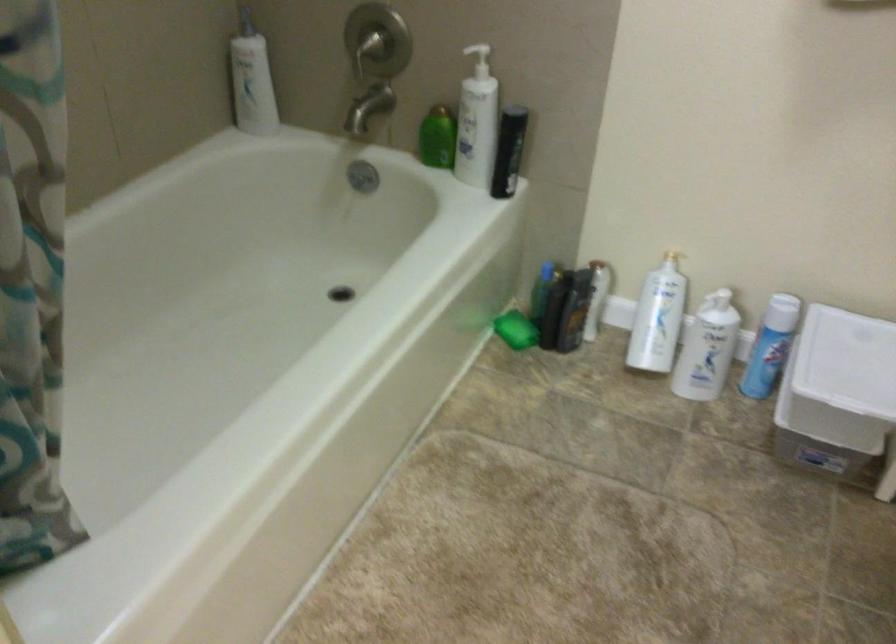
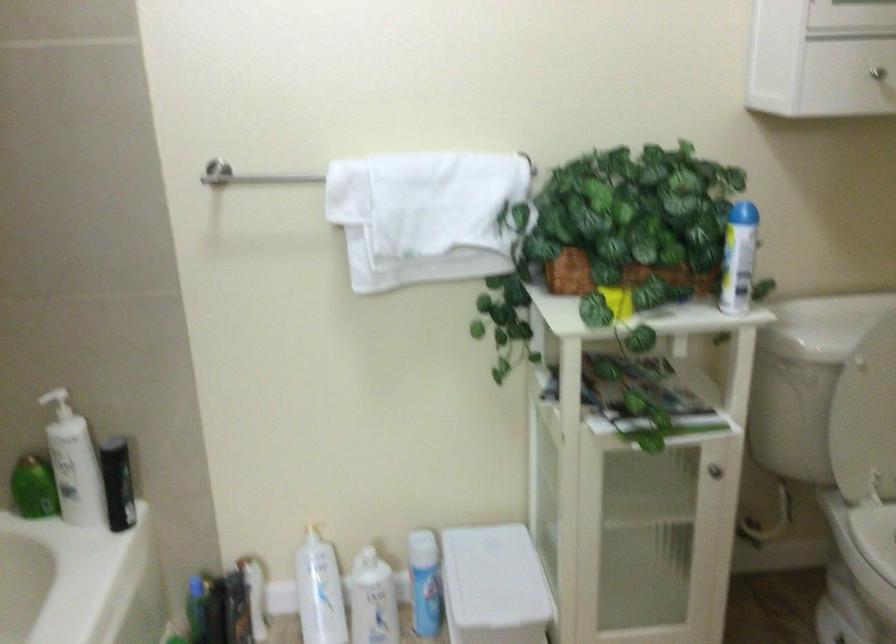
In the second image, find the point that corresponds to point 433,137 in the first image.

(33, 488)